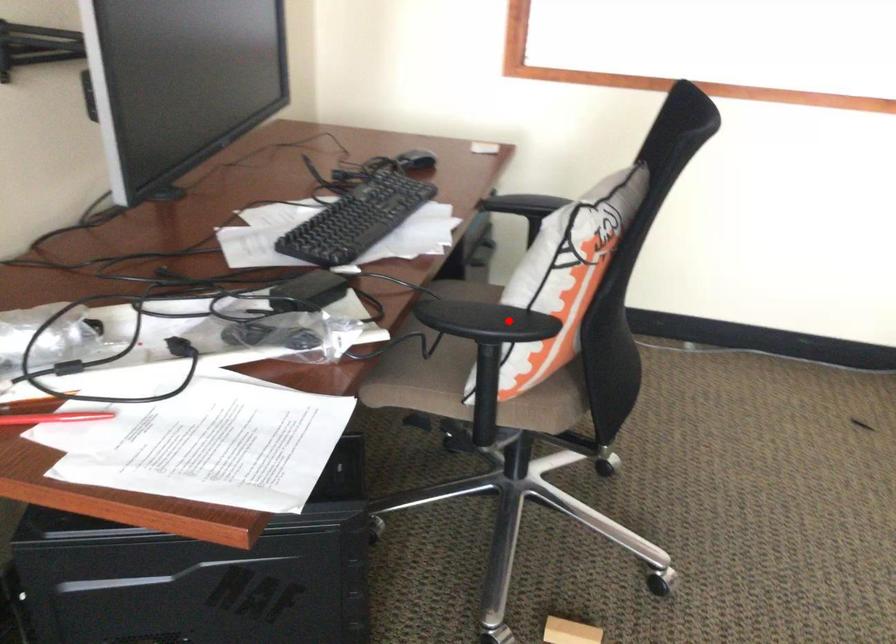
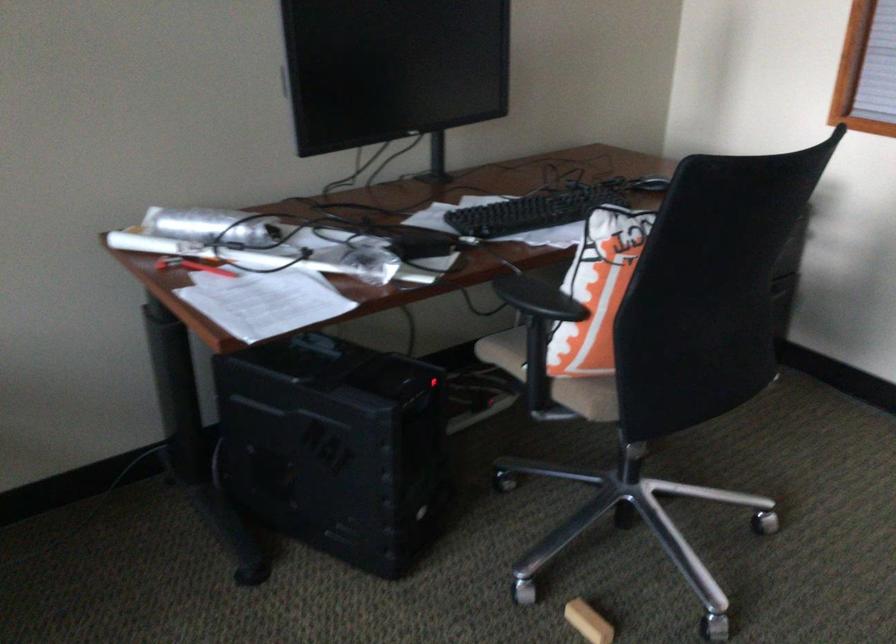
The point at the highlighted location is marked in the first image. Where is the corresponding point in the second image?

(538, 299)